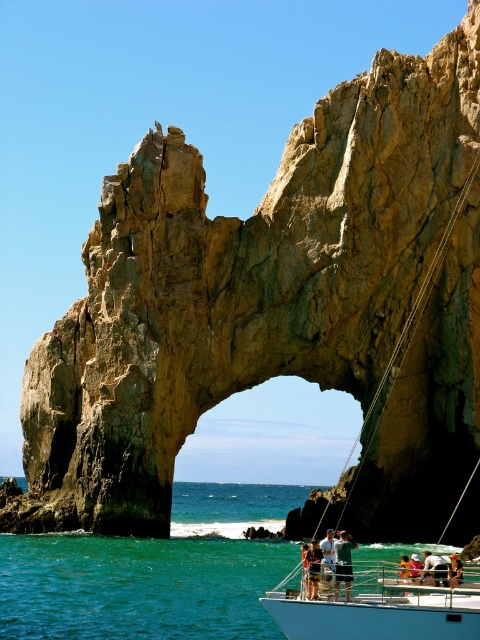
You are on a boat and see two people wearing matte black shorts at lower center and white fabric shirt at center. Which person is standing closer to the front of the boat?

The matte black shorts at lower center is closer to the viewer than the white fabric shirt at center, so the person wearing the matte black shorts at lower center is standing closer to the front of the boat.